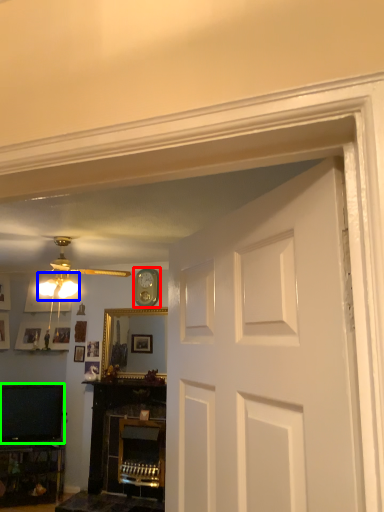
Question: Which object is positioned closest to clock (highlighted by a red box)? Select from lamp (highlighted by a blue box) and television (highlighted by a green box).

Choices:
 (A) lamp
 (B) television

Answer: (A)